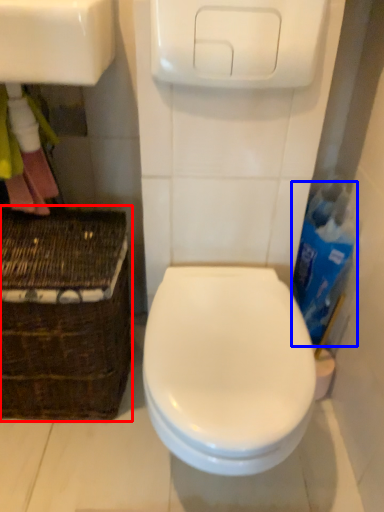
Question: Among these objects, which one is farthest to the camera, basket (highlighted by a red box) or cleaning product (highlighted by a blue box)?

Choices:
 (A) basket
 (B) cleaning product

Answer: (B)